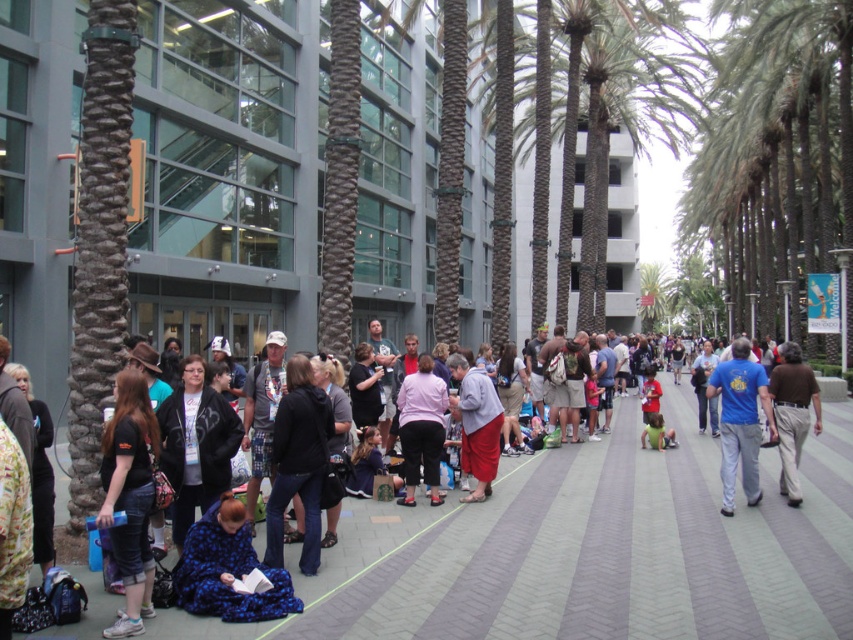
Question: Where is matte black shirt at lower left located in relation to blue fuzzy blanket at lower left in the image?

Choices:
 (A) below
 (B) above

Answer: (B)

Question: From the image, what is the correct spatial relationship of blue fuzzy blanket at lower left in relation to pink fabric pants at center?

Choices:
 (A) above
 (B) below

Answer: (B)

Question: Which point is farther from the camera taking this photo?

Choices:
 (A) (236, 611)
 (B) (405, 444)
 (C) (782, 484)
 (D) (149, 413)

Answer: (C)

Question: Among these objects, which one is nearest to the camera?

Choices:
 (A) blue t-shirt at center
 (B) blue fabric bag at lower center
 (C) pink fabric pants at center
 (D) blue fuzzy blanket at lower left

Answer: (D)

Question: Is blue fuzzy blanket at lower left positioned before pink fabric pants at center?

Choices:
 (A) no
 (B) yes

Answer: (B)

Question: Which point is farther to the camera?

Choices:
 (A) coord(318,406)
 (B) coord(248,570)
 (C) coord(412,376)
 (D) coord(746,492)

Answer: (C)